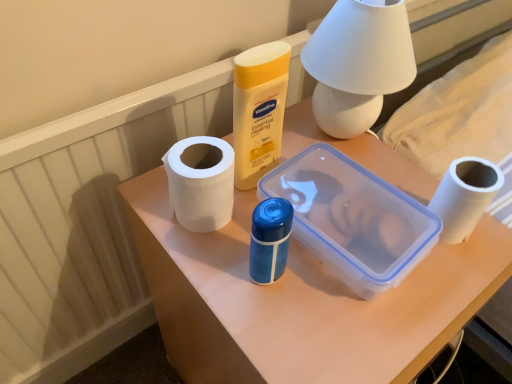
The image size is (512, 384). I want to click on free location in front of white matte toilet paper at right, so click(x=435, y=296).